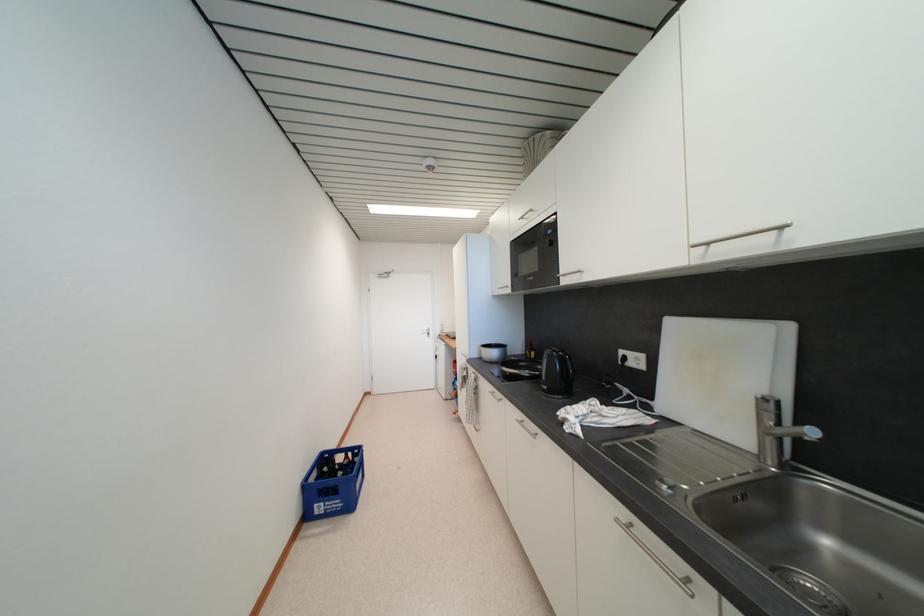
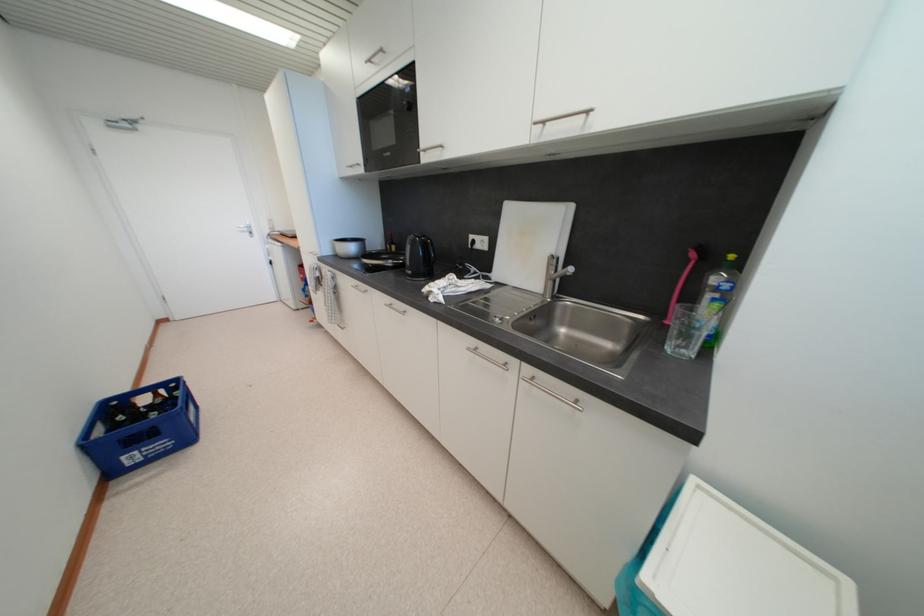
Locate, in the second image, the point that corresponds to pixel 551 390 in the first image.

(415, 275)